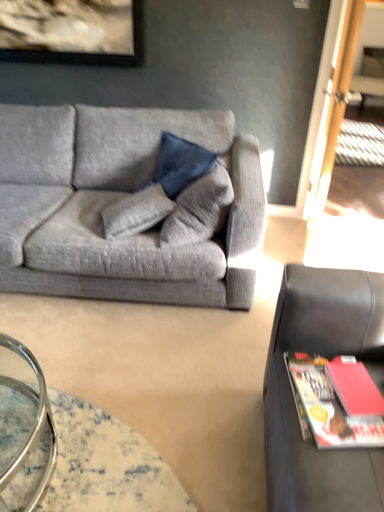
Locate an element on the screen. free space in front of matte red book at lower right is located at coordinates (348, 429).